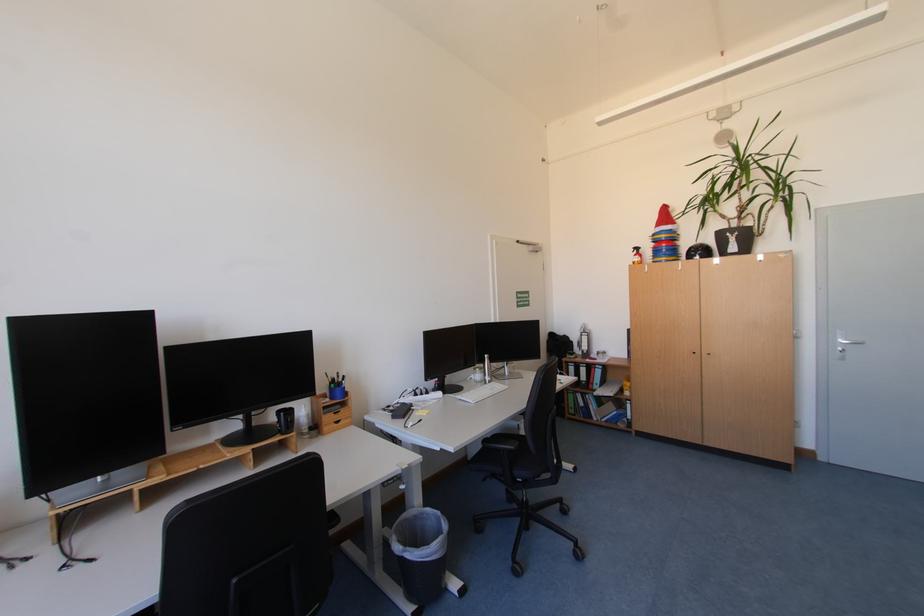
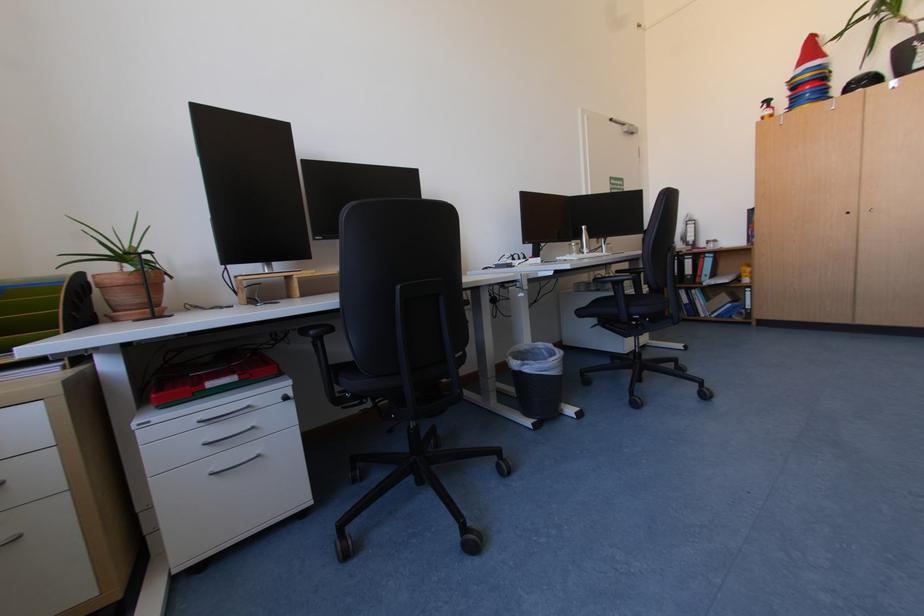
Question: The camera is either moving clockwise (left) or counter-clockwise (right) around the object. The first image is from the beginning of the video and the second image is from the end. Is the camera moving left or right when shooting the video?

Choices:
 (A) Left
 (B) Right

Answer: (B)